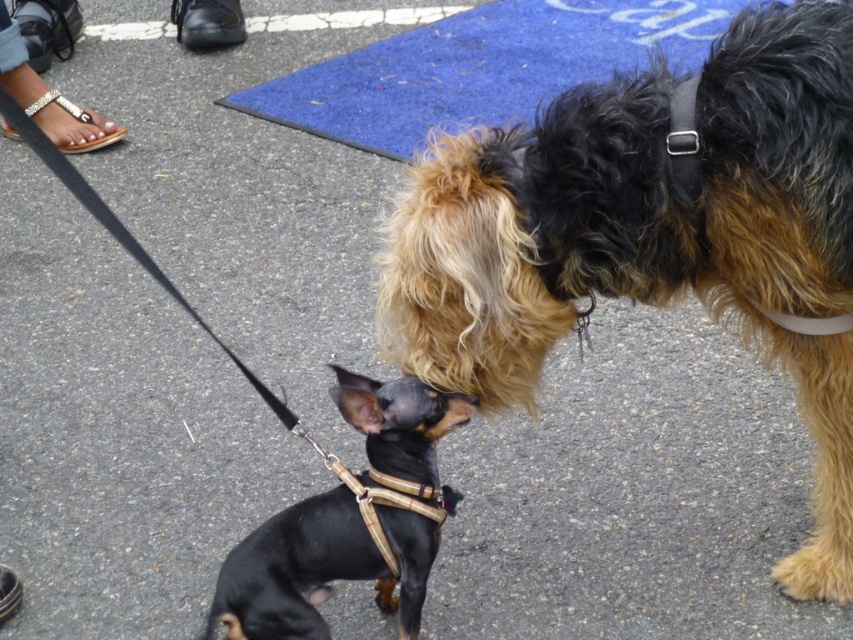
You are a dog owner who wants to ensure the safety of your pets. You see the black and tan fur at center and the black leather harness at center. Which one is taller?

The black and tan fur at center is taller than the black leather harness at center.

You are a dog owner trying to locate your two dogs in a photo. You see two points marked in the image. The first point is at coordinate point (x=764, y=22) and the second is at point (x=363, y=380). Which point is closer to you?

Point (x=764, y=22) is in front of point (x=363, y=380), so the first point is closer to you.